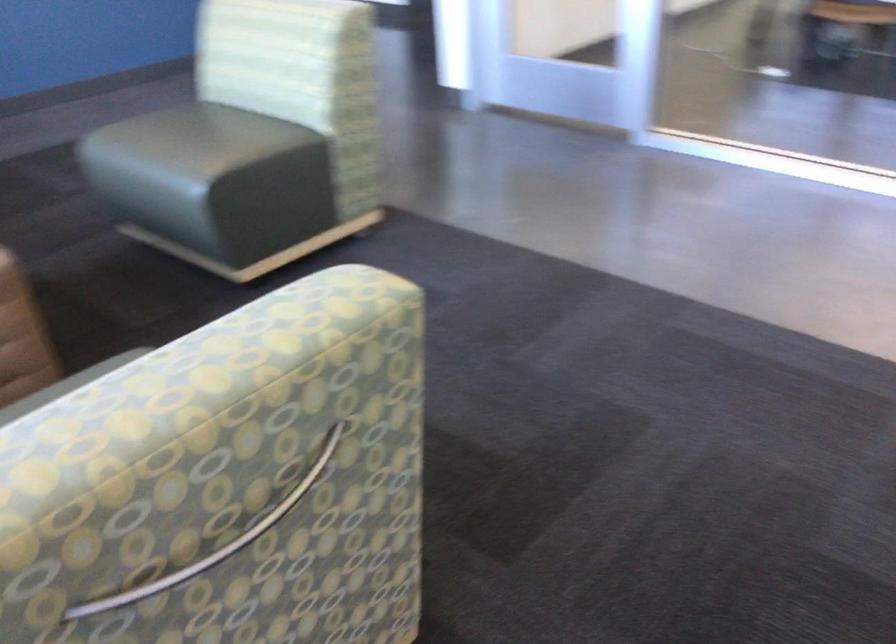
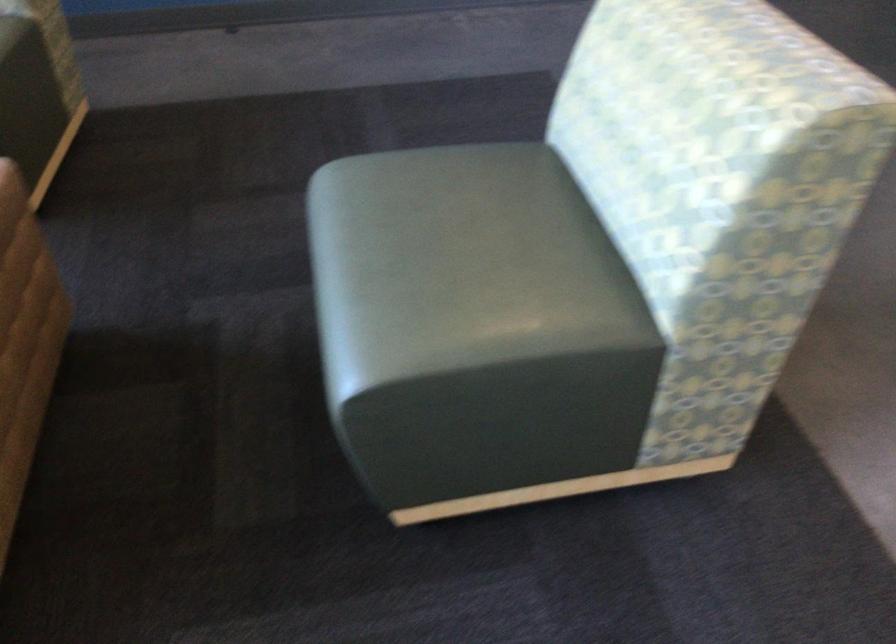
Locate, in the second image, the point that corresponds to the point at 218,147 in the first image.

(460, 265)